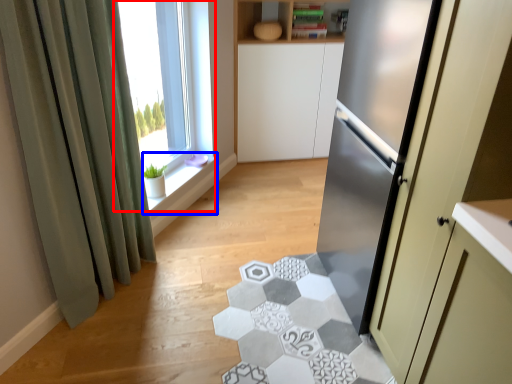
Question: Which object appears closest to the camera in this image, window (highlighted by a red box) or window sill (highlighted by a blue box)?

Choices:
 (A) window
 (B) window sill

Answer: (A)